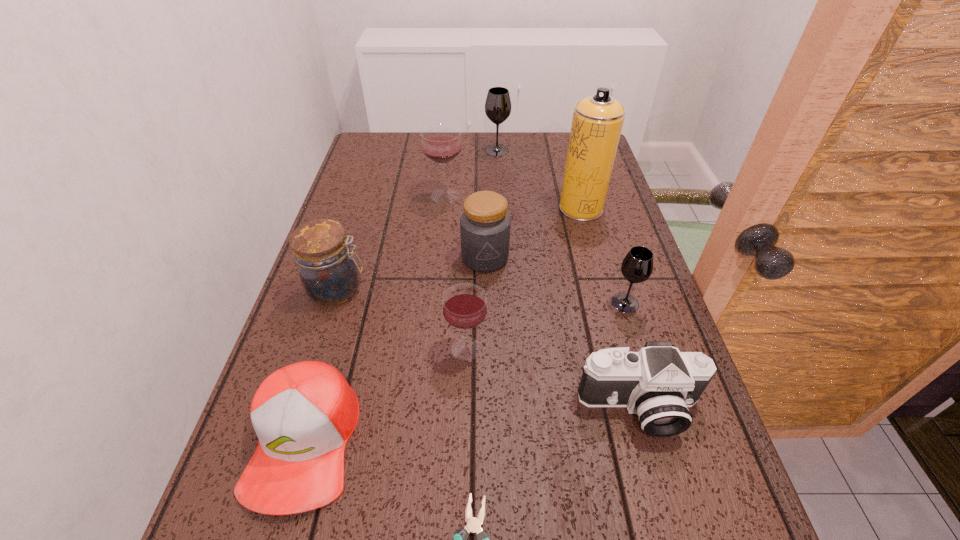
Where is `vacant space that satisfies the following two spatial constraints: 1. on the lid of the rightmost wineglass; 2. on the right side of the left jar`? This screenshot has height=540, width=960. vacant space that satisfies the following two spatial constraints: 1. on the lid of the rightmost wineglass; 2. on the right side of the left jar is located at coordinates (333, 303).

The height and width of the screenshot is (540, 960). In order to click on vacant area in the image that satisfies the following two spatial constraints: 1. on the front side of the right gray wineglass; 2. on the right side of the aerosol can in this screenshot , I will do `click(607, 303)`.

Locate an element on the screen. vacant point that satisfies the following two spatial constraints: 1. on the surface of the right jar near the warning symbol; 2. on the lid of the left jar is located at coordinates (486, 289).

Find the location of `free space that satisfies the following two spatial constraints: 1. on the lid of the nearer gray wineglass; 2. on the right side of the left jar`. free space that satisfies the following two spatial constraints: 1. on the lid of the nearer gray wineglass; 2. on the right side of the left jar is located at coordinates (333, 303).

Find the location of a particular element. The height and width of the screenshot is (540, 960). vacant space that satisfies the following two spatial constraints: 1. on the back side of the bigger red wineglass; 2. on the left side of the farther gray wineglass is located at coordinates (449, 150).